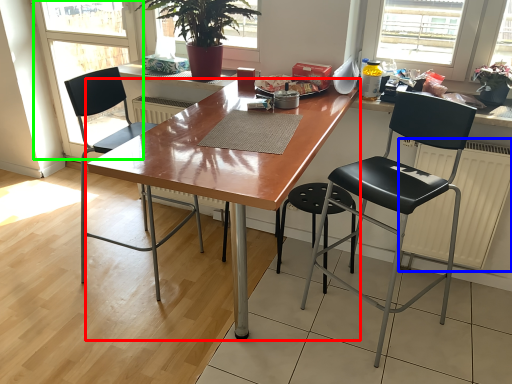
Question: Estimate the real-world distances between objects in this image. Which object is closer to desk (highlighted by a red box), radiator (highlighted by a blue box) or screen door (highlighted by a green box)?

Choices:
 (A) radiator
 (B) screen door

Answer: (A)